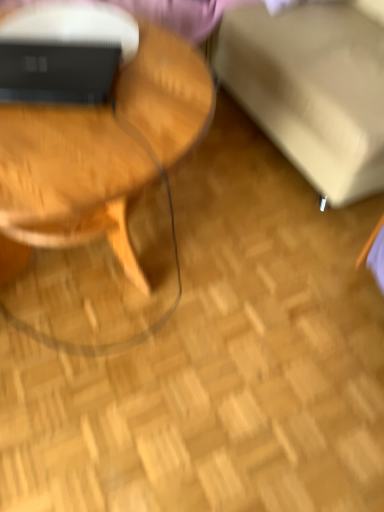
Question: Is beige fabric swivel chair at upper right wider or thinner than woodenmaterial/texturecoffee table at left?

Choices:
 (A) wide
 (B) thin

Answer: (A)

Question: From a real-world perspective, is beige fabric swivel chair at upper right physically located above or below woodenmaterial/texturecoffee table at left?

Choices:
 (A) below
 (B) above

Answer: (B)

Question: Based on their relative distances, which object is nearer to the matte black laptop at upper left?

Choices:
 (A) woodenmaterial/texturecoffee table at left
 (B) beige fabric swivel chair at upper right

Answer: (A)

Question: Based on their relative distances, which object is farther from the woodenmaterial/texturecoffee table at left?

Choices:
 (A) beige fabric swivel chair at upper right
 (B) matte black laptop at upper left

Answer: (A)